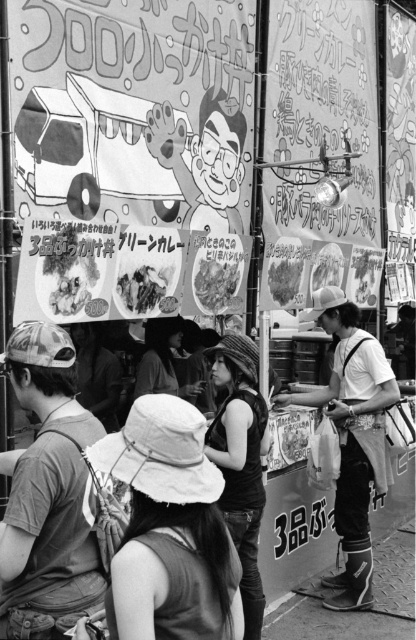
Can you confirm if metallic silver food truck at upper left is positioned to the left of white fabric apron at right?

Correct, you'll find metallic silver food truck at upper left to the left of white fabric apron at right.

The image size is (416, 640). Identify the location of metallic silver food truck at upper left. click(99, 150).

Find the location of a particular element. Image resolution: width=416 pixels, height=640 pixels. metallic silver food truck at upper left is located at coordinates (99, 150).